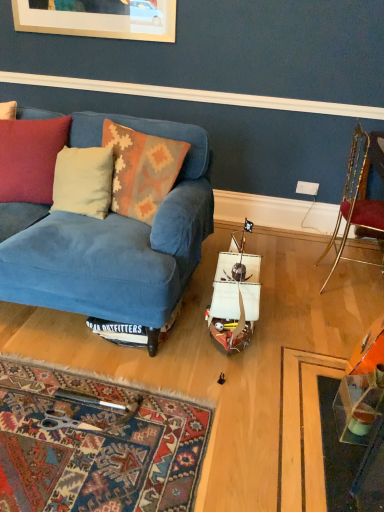
Locate an element on the screen. The height and width of the screenshot is (512, 384). free spot behind transparent plastic table at lower right is located at coordinates (321, 388).